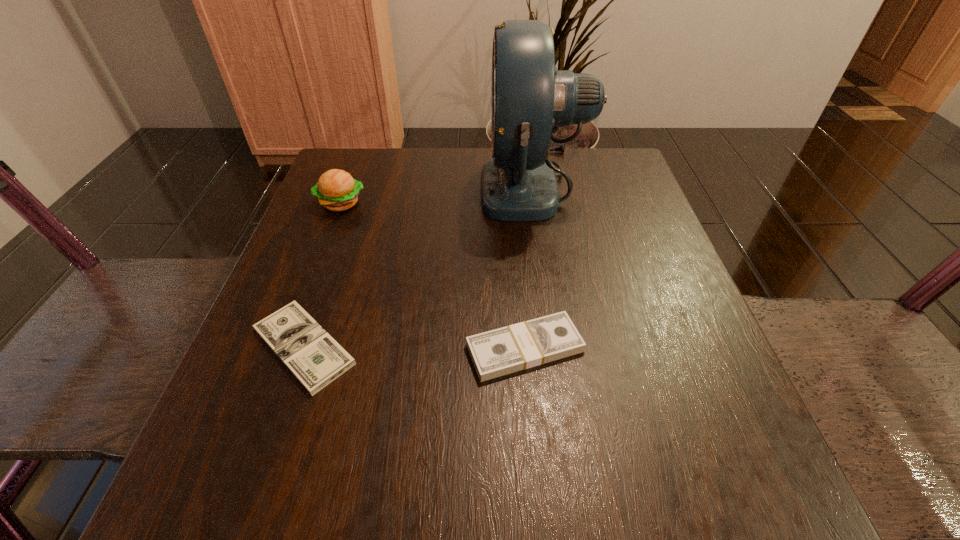
Find the location of a particular element. The image size is (960, 540). vacant space in between the right dollar and the tallest object is located at coordinates (529, 267).

Find the location of a particular element. This screenshot has height=540, width=960. vacant space that is in between the left dollar and the hamburger is located at coordinates point(323,275).

At what (x,y) coordinates should I click in order to perform the action: click on free space between the hamburger and the right dollar. Please return your answer as a coordinate pair (x, y). Image resolution: width=960 pixels, height=540 pixels. Looking at the image, I should click on (433, 276).

This screenshot has width=960, height=540. What are the coordinates of `vacant space that is in between the third shortest object and the tallest object` in the screenshot? It's located at (437, 195).

Locate an element on the screen. Image resolution: width=960 pixels, height=540 pixels. vacant space that's between the second shortest object and the shorter dollar is located at coordinates (415, 347).

I want to click on object that is the second closest to the hamburger, so click(530, 98).

Locate an element on the screen. The width and height of the screenshot is (960, 540). the second closest object to the second tallest object is located at coordinates (530, 98).

Locate an element on the screen. The width and height of the screenshot is (960, 540). vacant position in the image that satisfies the following two spatial constraints: 1. on the front side of the left dollar; 2. on the left side of the third shortest object is located at coordinates (287, 347).

Locate an element on the screen. vacant region that satisfies the following two spatial constraints: 1. on the front side of the second tallest object; 2. on the left side of the taller dollar is located at coordinates (286, 348).